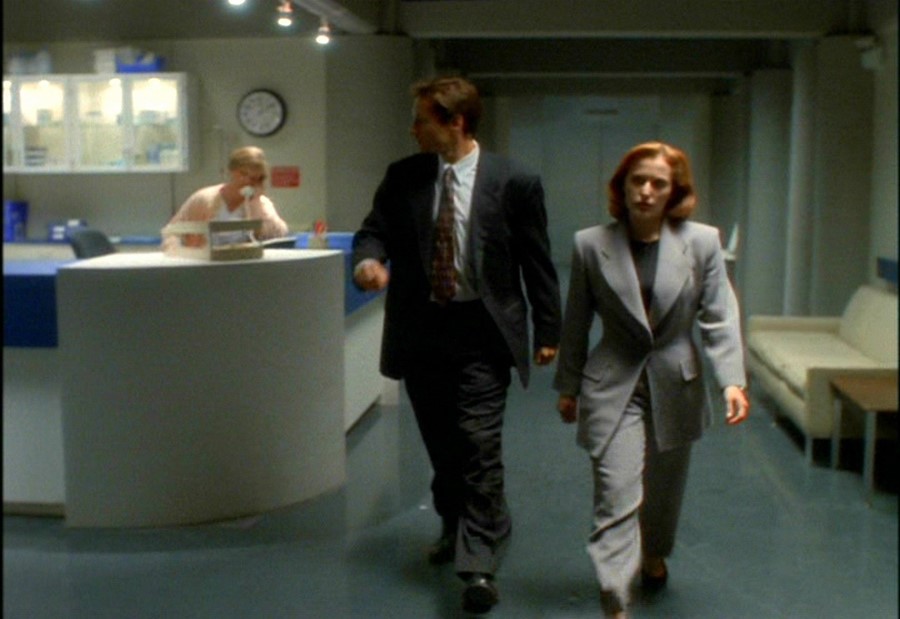
You are a GUI agent. You are given a task and a screenshot of the screen. Output one action in this format:
    pyautogui.click(x=<x>, y=<y>)
    Task: Click on the glass doors
    The height and width of the screenshot is (619, 900).
    Given the screenshot: What is the action you would take?
    pyautogui.click(x=150, y=124), pyautogui.click(x=94, y=111), pyautogui.click(x=48, y=122)